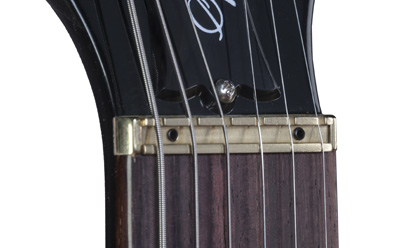
Locate an element on the screen. The width and height of the screenshot is (398, 248). scuffs on wood is located at coordinates (121, 221), (120, 212), (134, 161).